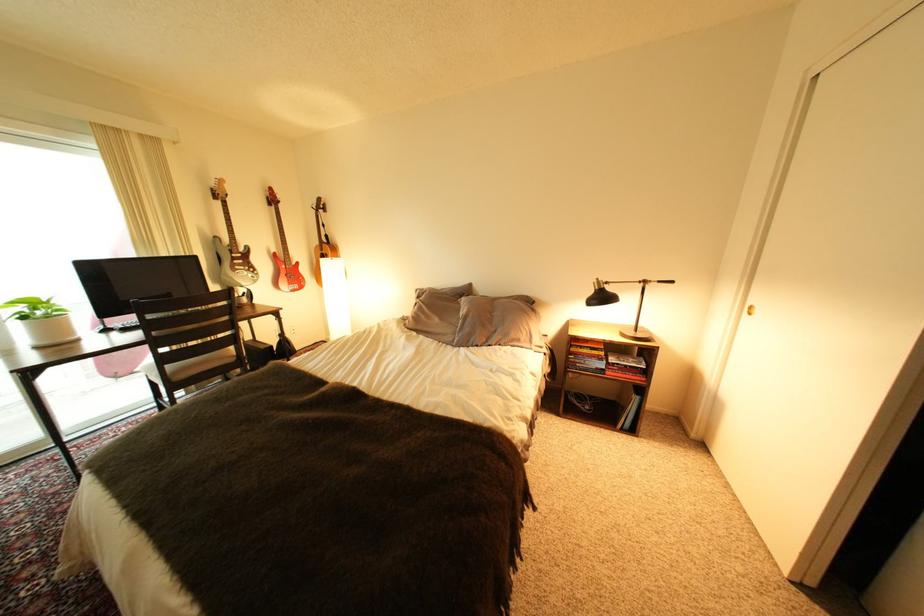
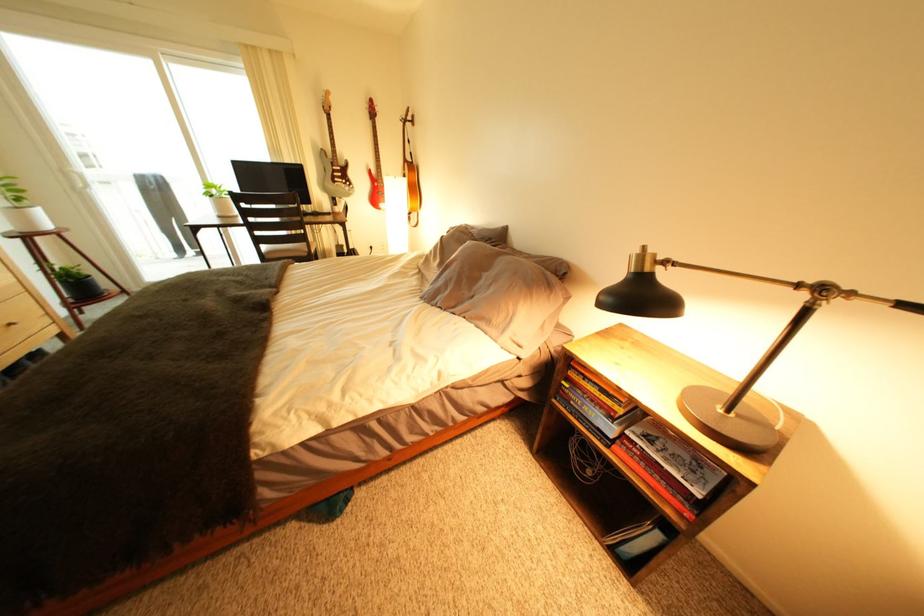
Question: I am providing you with two images of the same scene from different viewpoints. Which of the following objects are not visible in image2?

Choices:
 (A) book
 (B) black lamp head
 (C) acoustic guitar
 (D) none of these

Answer: (D)